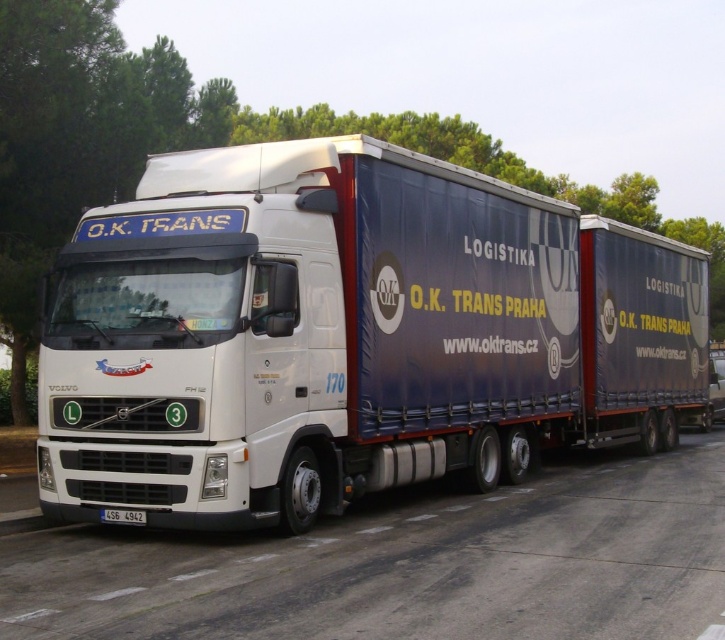
Question: Which point is closer to the camera?

Choices:
 (A) (239, 385)
 (B) (133, 516)

Answer: (A)

Question: Is white matte truck at center further to the viewer compared to white plastic license plate at center?

Choices:
 (A) yes
 (B) no

Answer: (B)

Question: Which point is farther to the camera?

Choices:
 (A) (86, 276)
 (B) (133, 516)

Answer: (A)

Question: Is white matte truck at center below white plastic license plate at center?

Choices:
 (A) yes
 (B) no

Answer: (B)

Question: Is white matte truck at center below white plastic license plate at center?

Choices:
 (A) yes
 (B) no

Answer: (B)

Question: Which point appears farthest from the camera in this image?

Choices:
 (A) (115, 513)
 (B) (111, 241)

Answer: (B)